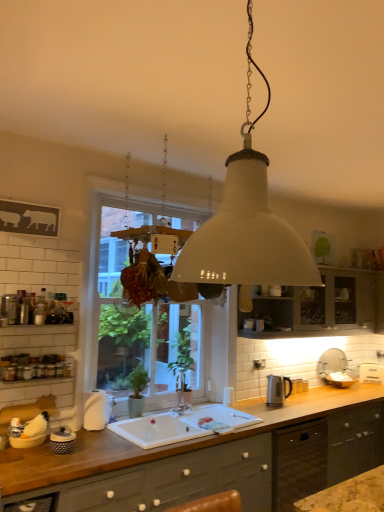
Find the location of a particular element. free space to the left of matte black container at lower left, arranged as the first appliance when viewed from the front is located at coordinates (38, 448).